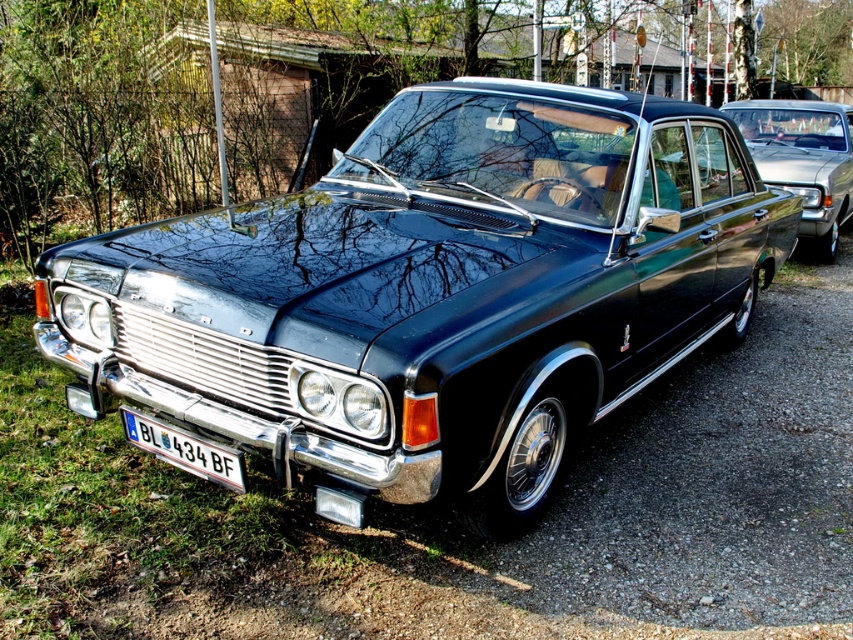
Question: Which object is closer to the camera taking this photo?

Choices:
 (A) white plastic license plate at lower left
 (B) shiny metallic sedan at center
 (C) shiny black car at center

Answer: (C)

Question: Which object is positioned closest to the shiny black car at center?

Choices:
 (A) shiny metallic sedan at center
 (B) white plastic license plate at lower left

Answer: (B)

Question: Is shiny black car at center further to camera compared to white plastic license plate at lower left?

Choices:
 (A) yes
 (B) no

Answer: (B)

Question: Which object appears farthest from the camera in this image?

Choices:
 (A) shiny metallic sedan at center
 (B) white plastic license plate at lower left
 (C) shiny black car at center

Answer: (A)

Question: From the image, what is the correct spatial relationship of shiny black car at center in relation to white plastic license plate at lower left?

Choices:
 (A) above
 (B) below

Answer: (A)

Question: Is shiny black car at center further to camera compared to shiny metallic sedan at center?

Choices:
 (A) no
 (B) yes

Answer: (A)